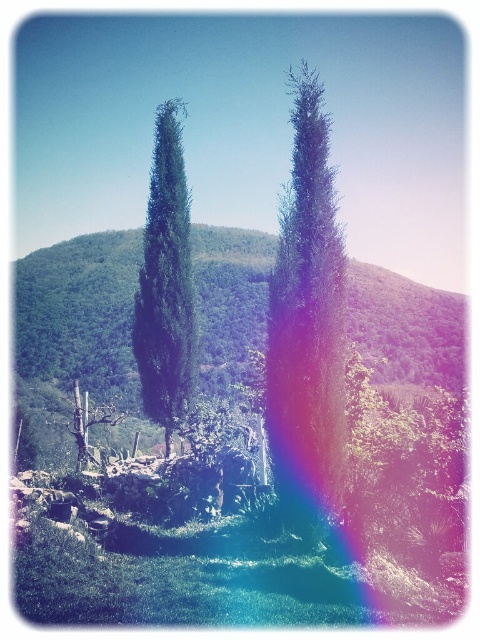
Question: Where is green textured tree at center located in relation to green matte tree at center in the image?

Choices:
 (A) above
 (B) below

Answer: (A)

Question: Does green textured tree at center appear under green matte tree at center?

Choices:
 (A) no
 (B) yes

Answer: (A)

Question: Which point is farther from the camera taking this photo?

Choices:
 (A) (167, 353)
 (B) (278, 337)

Answer: (A)

Question: Among these objects, which one is nearest to the camera?

Choices:
 (A) green matte tree at center
 (B) green textured tree at center

Answer: (B)

Question: Is green textured tree at center positioned before green matte tree at center?

Choices:
 (A) no
 (B) yes

Answer: (B)